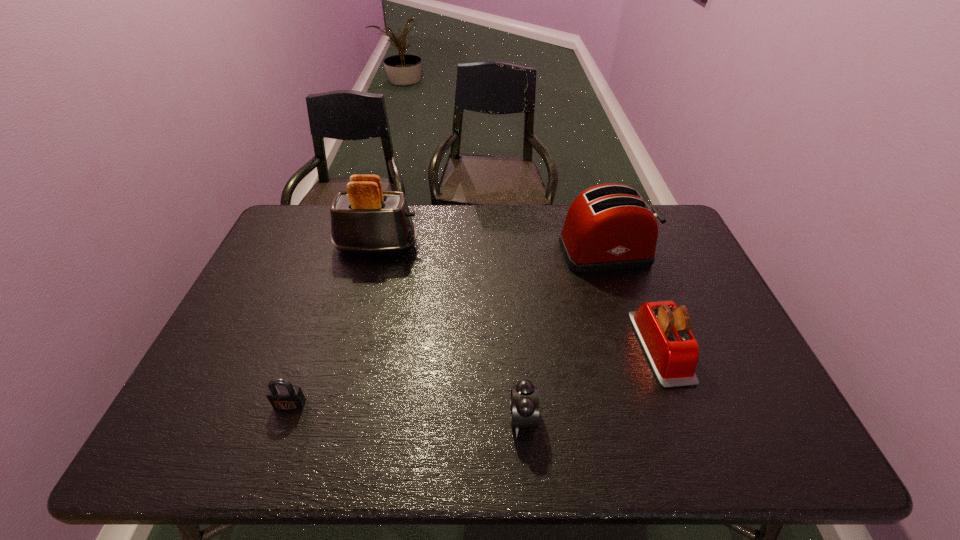
You are a GUI agent. You are given a task and a screenshot of the screen. Output one action in this format:
    pyautogui.click(x=<x>, y=<y>)
    Task: Click on the free space located 0.120m on the front side of the third object from left to right
    The width and height of the screenshot is (960, 540).
    Given the screenshot: What is the action you would take?
    pyautogui.click(x=456, y=418)

The width and height of the screenshot is (960, 540). I want to click on blank space located on the front side of the third object from left to right, so click(x=407, y=418).

Identify the location of vacant area situated on the front of the padlock near the keyhole. (273, 454).

This screenshot has width=960, height=540. In order to click on object present at the near edge in this screenshot , I will do `click(524, 405)`.

Image resolution: width=960 pixels, height=540 pixels. Find the location of `object that is at the far right corner`. object that is at the far right corner is located at coordinates [x=609, y=227].

In the image, there is a desktop. Find the location of `blank space at the far edge`. blank space at the far edge is located at coordinates (441, 222).

Locate an element on the screen. vacant area at the near edge of the desktop is located at coordinates (581, 425).

I want to click on free space at the left edge of the desktop, so click(x=279, y=284).

Where is `free space at the right edge`? free space at the right edge is located at coordinates (745, 396).

I want to click on vacant space at the near left corner of the desktop, so click(x=180, y=456).